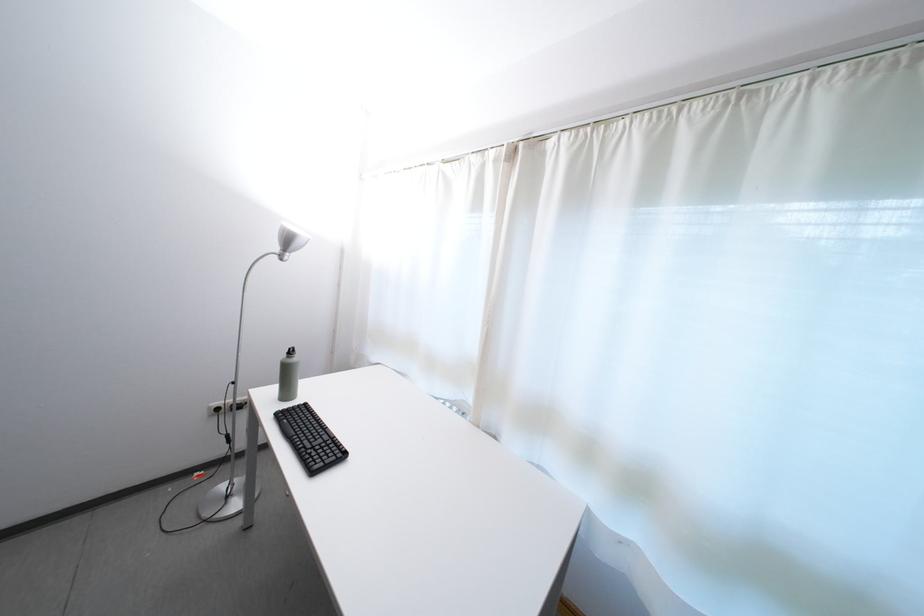
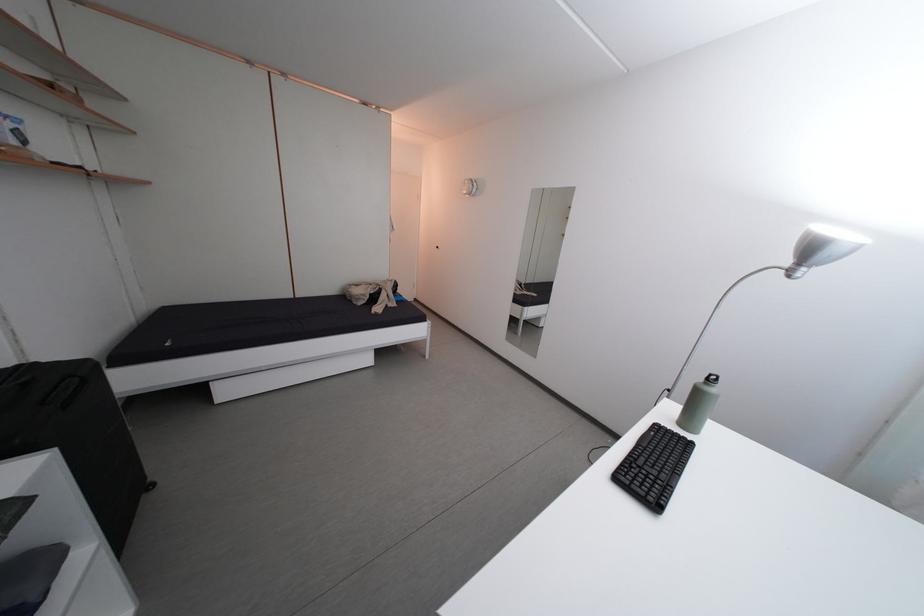
Question: The camera is either moving clockwise (left) or counter-clockwise (right) around the object. The first image is from the beginning of the video and the second image is from the end. Is the camera moving left or right when shooting the video?

Choices:
 (A) Left
 (B) Right

Answer: (B)